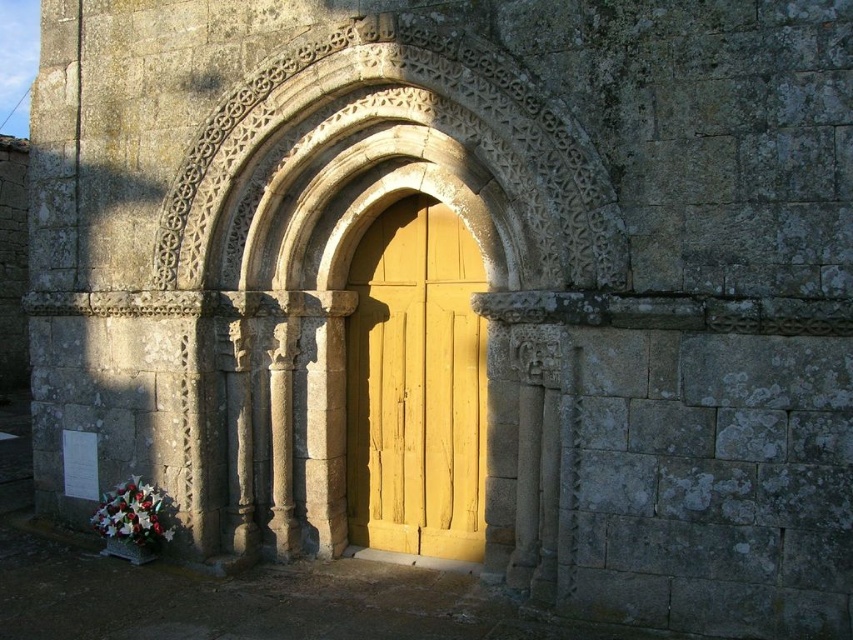
Between carved stone archway at center and yellow wood door at center, which one appears on the left side from the viewer's perspective?

From the viewer's perspective, carved stone archway at center appears more on the left side.

Who is more forward, (373, 84) or (471, 406)?

Point (373, 84)

I want to click on carved stone archway at center, so click(x=387, y=163).